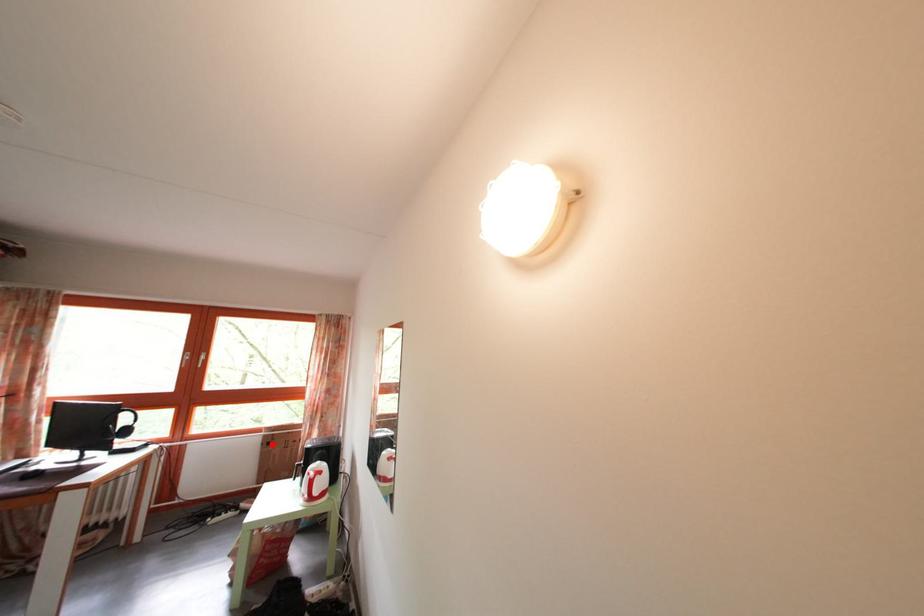
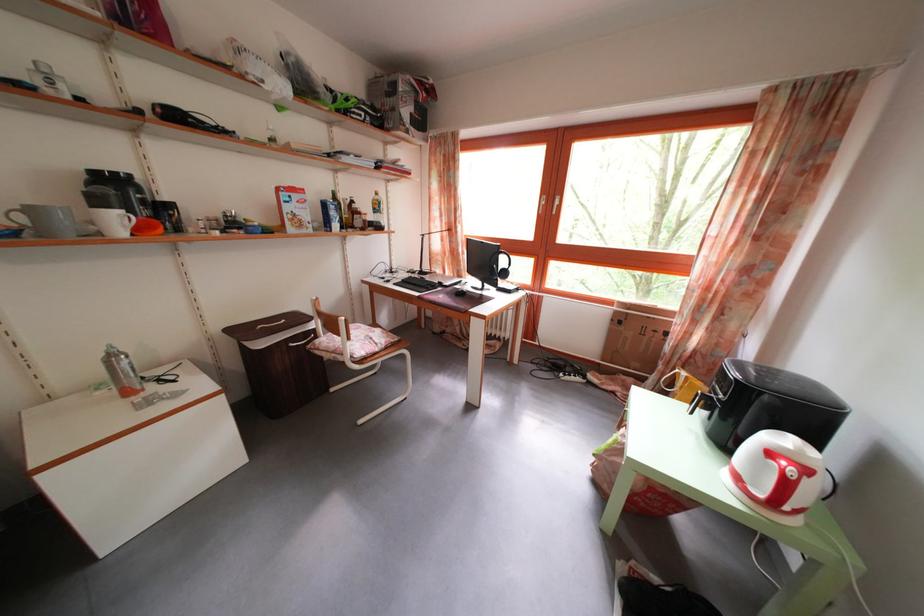
The point at the highlighted location is marked in the first image. Where is the corresponding point in the second image?

(623, 320)